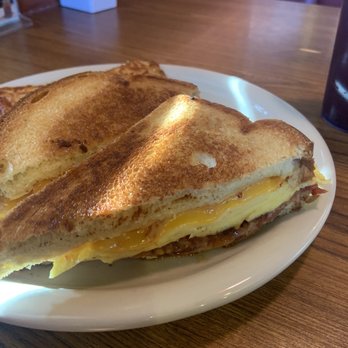
The image size is (348, 348). What are the coordinates of `plate` in the screenshot? It's located at (246, 257).